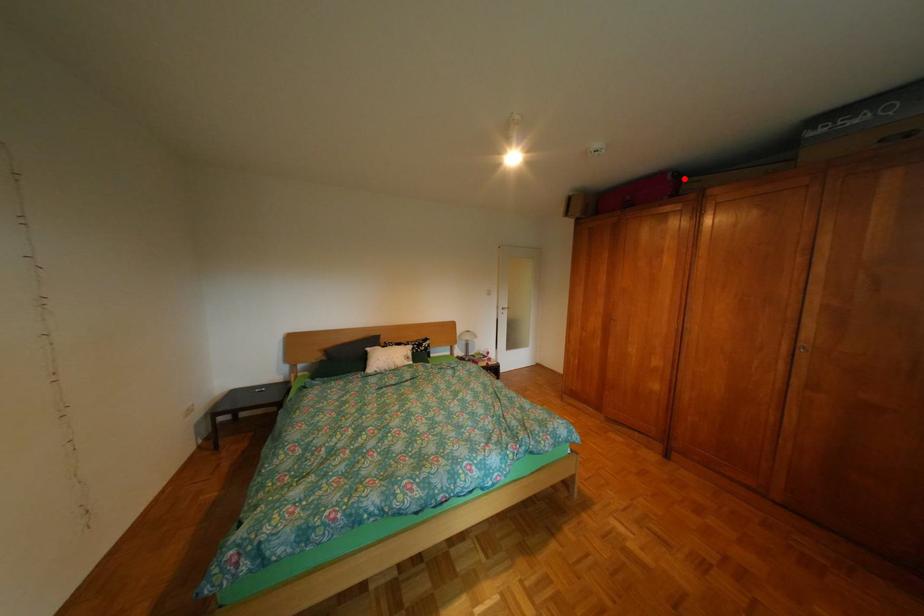
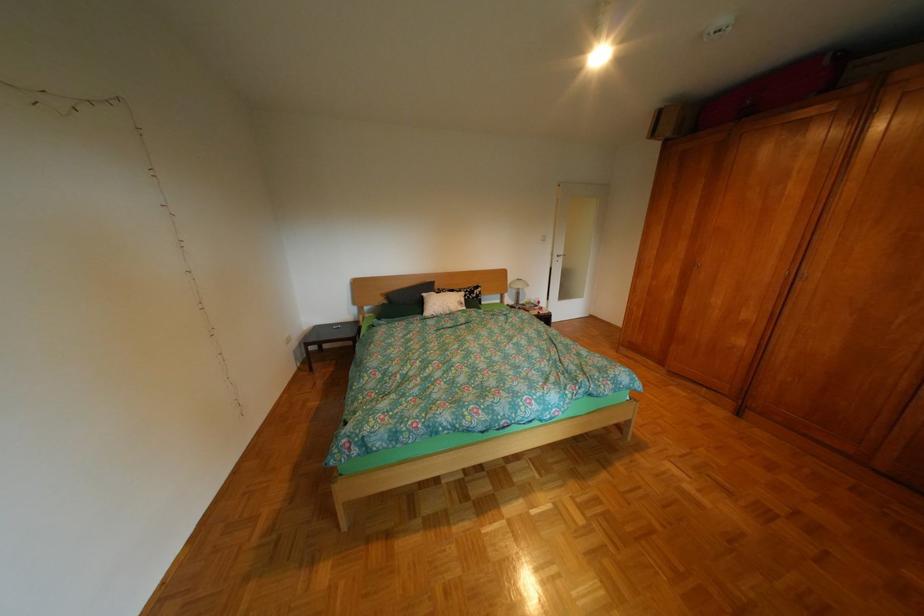
Question: I am providing you with two images of the same scene from different viewpoints. A red point is shown in image1. For the corresponding object point in image2, is it positioned nearer or farther from the camera?

Choices:
 (A) Nearer
 (B) Farther

Answer: (B)